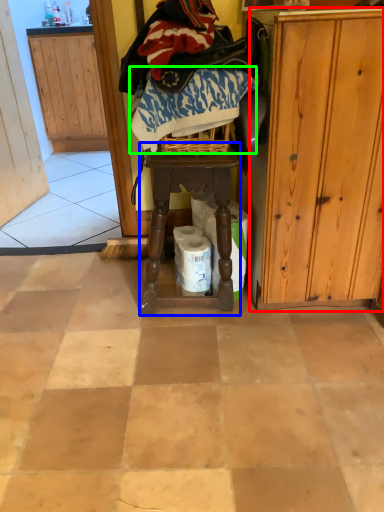
Question: Considering the real-world distances, which object is closest to cabinetry (highlighted by a red box)? furniture (highlighted by a blue box) or clothing (highlighted by a green box).

Choices:
 (A) furniture
 (B) clothing

Answer: (A)